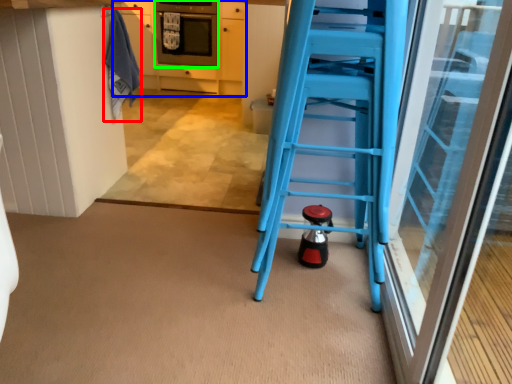
Question: Based on their relative distances, which object is nearer to laundry (highlighted by a red box)? Choose from cabinetry (highlighted by a blue box) and oven (highlighted by a green box).

Choices:
 (A) cabinetry
 (B) oven

Answer: (A)